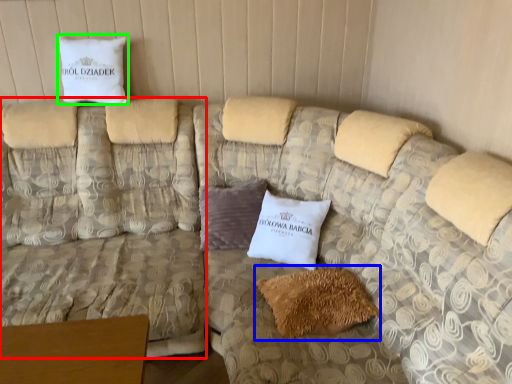
Question: Which object is the closest to the couch (highlighted by a red box)? Choose among these: pillow (highlighted by a blue box) or pillow (highlighted by a green box).

Choices:
 (A) pillow
 (B) pillow

Answer: (B)